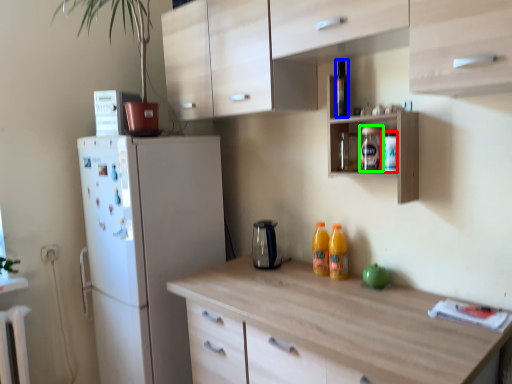
Question: Which object is positioned closest to bottle (highlighted by a red box)? Select from bottle (highlighted by a blue box) and bottle (highlighted by a green box).

Choices:
 (A) bottle
 (B) bottle

Answer: (B)